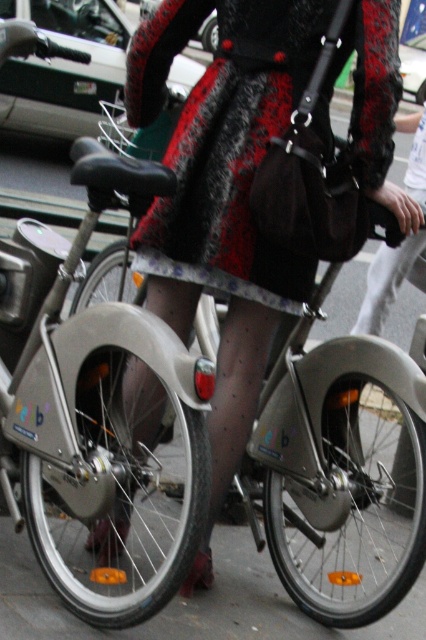
You are a delivery person who needs to deliver a package to a specific location marked at point (224, 140). You see the black fuzzy coat at center. Is the package delivery location on the person wearing the black fuzzy coat at center?

The black fuzzy coat at center is located at point (224, 140), so yes, the package delivery location is on the person wearing the black fuzzy coat at center.